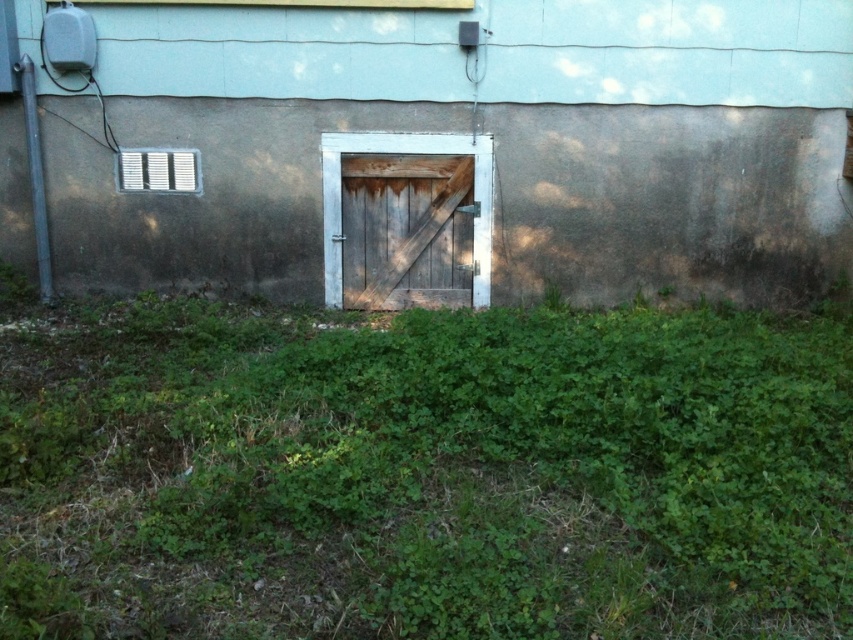
This screenshot has height=640, width=853. Identify the location of rusty wood door at center. (434, 147).

Is point (815, 234) closer to camera compared to point (381, 134)?

No, it is behind (381, 134).

Image resolution: width=853 pixels, height=640 pixels. What are the coordinates of `rusty wood door at center` in the screenshot? It's located at (434, 147).

Does green leafy grass at center have a greater width compared to weathered wood barn door at center?

Yes, green leafy grass at center is wider than weathered wood barn door at center.

Is point (740, 388) behind point (338, 227)?

No, it is in front of (338, 227).

What are the coordinates of `green leafy grass at center` in the screenshot? It's located at (425, 474).

From the picture: Who is positioned more to the right, green leafy grass at center or rusty wood door at center?

Positioned to the right is rusty wood door at center.

Who is lower down, green leafy grass at center or rusty wood door at center?

green leafy grass at center

Who is more distant from viewer, (608, 611) or (646, 125)?

Point (646, 125)

In order to click on green leafy grass at center in this screenshot , I will do `click(425, 474)`.